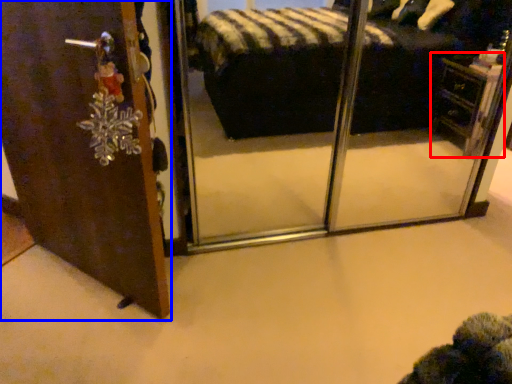
Question: Which of the following is the closest to the observer, vanity (highlighted by a red box) or door (highlighted by a blue box)?

Choices:
 (A) vanity
 (B) door

Answer: (B)